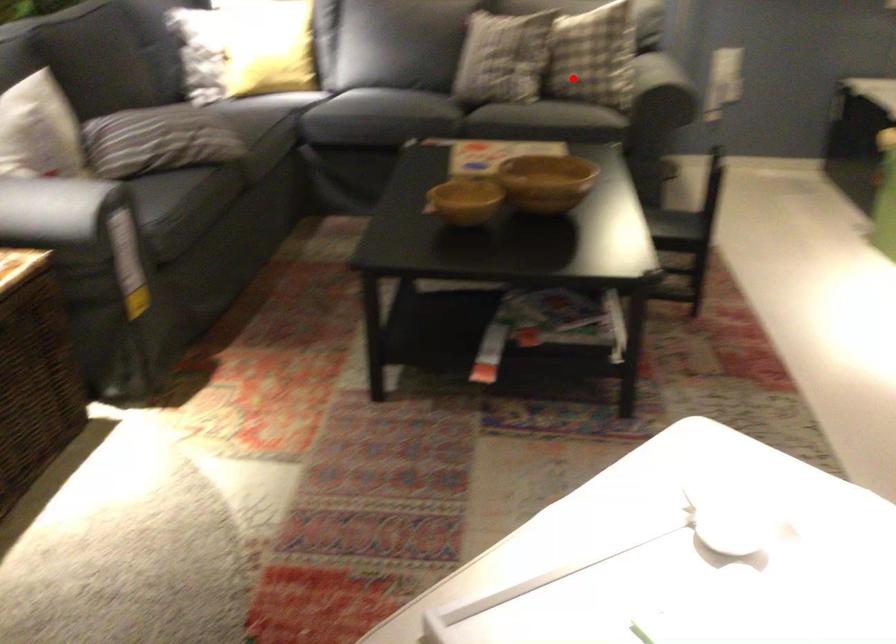
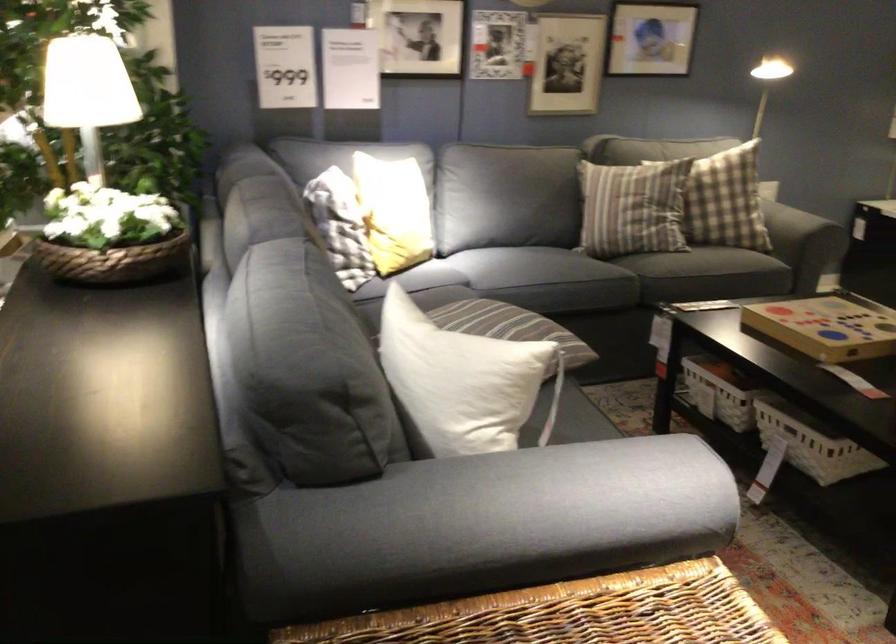
Question: I am providing you with two images of the same scene from different viewpoints. A red point is shown in image1. For the corresponding object point in image2, is it positioned nearer or farther from the camera?

Choices:
 (A) Nearer
 (B) Farther

Answer: (A)